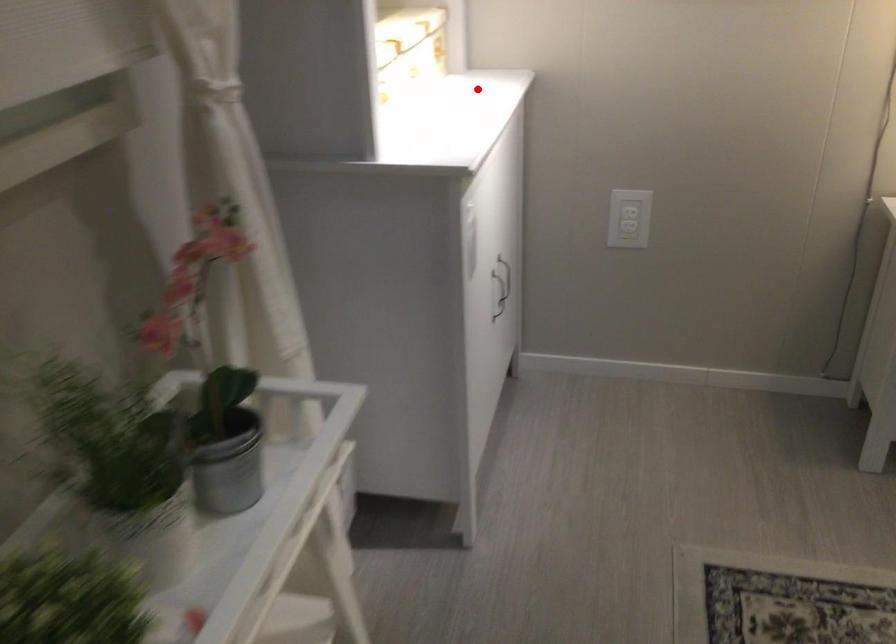
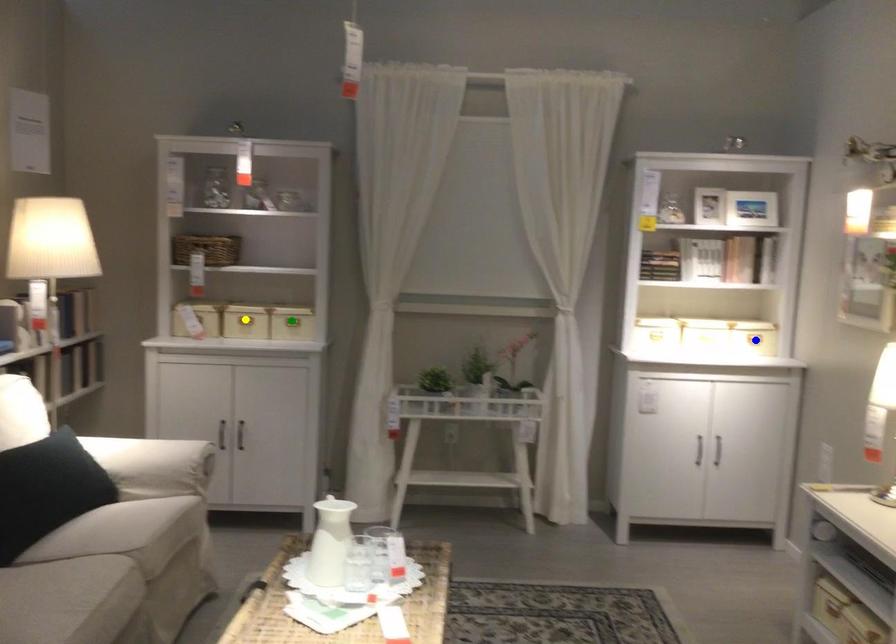
Question: I am providing you with two images of the same scene from different viewpoints. A red point is marked on the first image. You are given multiple points on the second image. In image 2, which mark is for the same physical point as the one in image 1?

Choices:
 (A) green point
 (B) yellow point
 (C) blue point

Answer: (C)